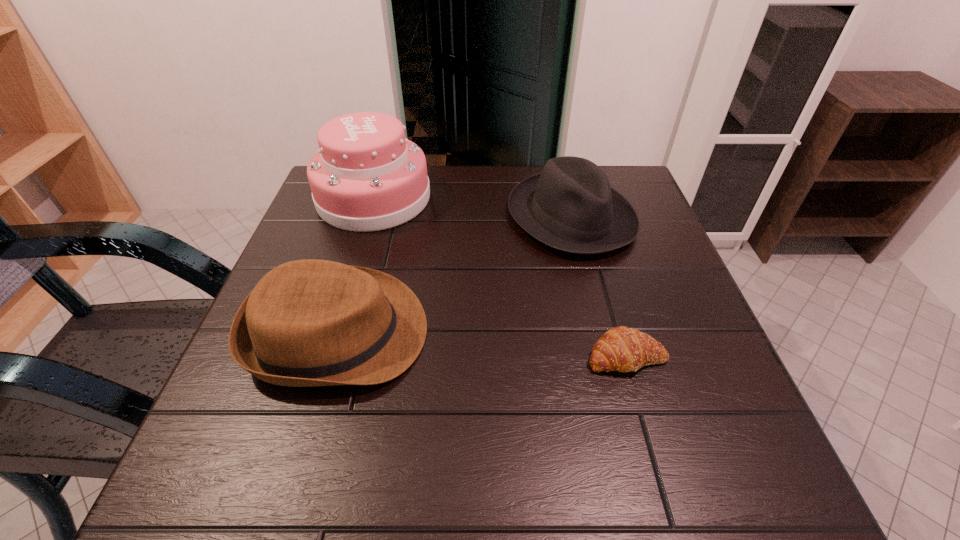
You are a GUI agent. You are given a task and a screenshot of the screen. Output one action in this format:
    pyautogui.click(x=<x>, y=<y>)
    Task: Click on the cake that is at the left edge
    Image resolution: width=960 pixels, height=540 pixels.
    Given the screenshot: What is the action you would take?
    366,176

Locate an element on the screen. The width and height of the screenshot is (960, 540). fedora that is at the left edge is located at coordinates (306, 323).

Image resolution: width=960 pixels, height=540 pixels. Find the location of `fedora that is at the right edge`. fedora that is at the right edge is located at coordinates (570, 206).

I want to click on crescent roll that is positioned at the right edge, so click(x=623, y=349).

You are a GUI agent. You are given a task and a screenshot of the screen. Output one action in this format:
    pyautogui.click(x=<x>, y=<y>)
    Task: Click on the object at the far left corner
    The width and height of the screenshot is (960, 540).
    Given the screenshot: What is the action you would take?
    pyautogui.click(x=366, y=176)

Locate an element on the screen. The height and width of the screenshot is (540, 960). object located in the far right corner section of the desktop is located at coordinates (570, 206).

This screenshot has height=540, width=960. What are the coordinates of `vacant position at the near edge of the desktop` in the screenshot? It's located at (322, 466).

This screenshot has width=960, height=540. I want to click on vacant space at the left edge of the desktop, so click(217, 437).

In the image, there is a desktop. Where is `vacant space at the right edge`? The height and width of the screenshot is (540, 960). vacant space at the right edge is located at coordinates (748, 417).

Locate an element on the screen. Image resolution: width=960 pixels, height=540 pixels. vacant area at the far right corner is located at coordinates (637, 201).